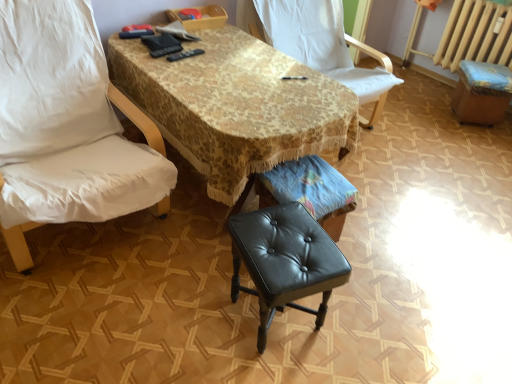
This screenshot has height=384, width=512. I want to click on free space in front of black leather bar stool at lower right, so click(480, 139).